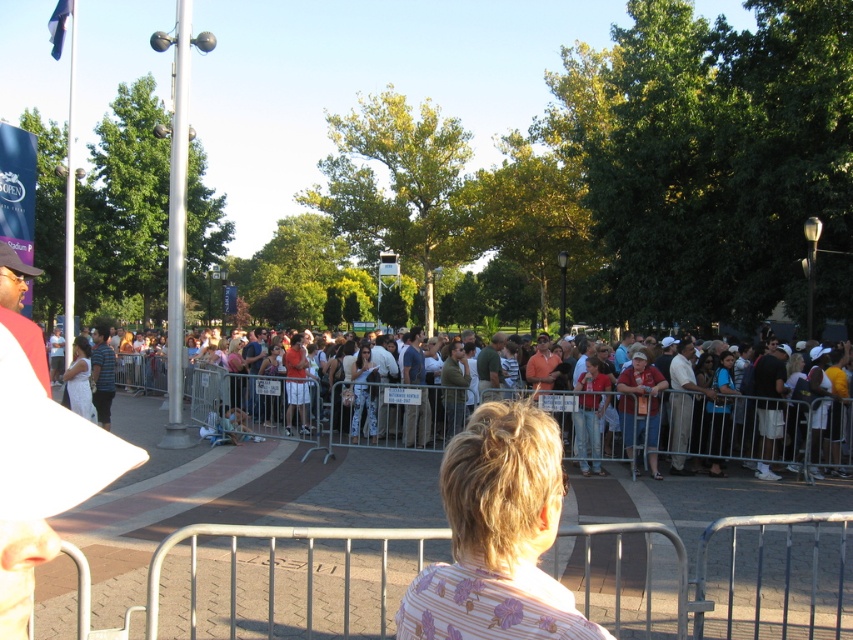
Can you confirm if multicolored casual attire at center is thinner than white cotton dress at center?

No.

Who is shorter, multicolored casual attire at center or white cotton dress at center?

white cotton dress at center is shorter.

Who is more forward, (566, 413) or (90, 400)?

Point (566, 413) is more forward.

Identify the location of multicolored casual attire at center. The height and width of the screenshot is (640, 853). (714, 422).

Is multicolored casual attire at center positioned before blonde hair at center?

No, multicolored casual attire at center is further to the viewer.

Who is positioned more to the left, multicolored casual attire at center or blonde hair at center?

multicolored casual attire at center is more to the left.

The image size is (853, 640). What do you see at coordinates (714, 422) in the screenshot?
I see `multicolored casual attire at center` at bounding box center [714, 422].

You are a GUI agent. You are given a task and a screenshot of the screen. Output one action in this format:
    pyautogui.click(x=<x>, y=<y>)
    Task: Click on the multicolored casual attire at center
    The image size is (853, 640).
    Given the screenshot: What is the action you would take?
    [x=714, y=422]

Looking at this image, between multicolored casual attire at center and silver metallic barricade at center, which one has more height?

multicolored casual attire at center

Who is more forward, (263, 394) or (233, 595)?

Point (233, 595) is more forward.

This screenshot has width=853, height=640. Find the location of `multicolored casual attire at center`. multicolored casual attire at center is located at coordinates (714, 422).